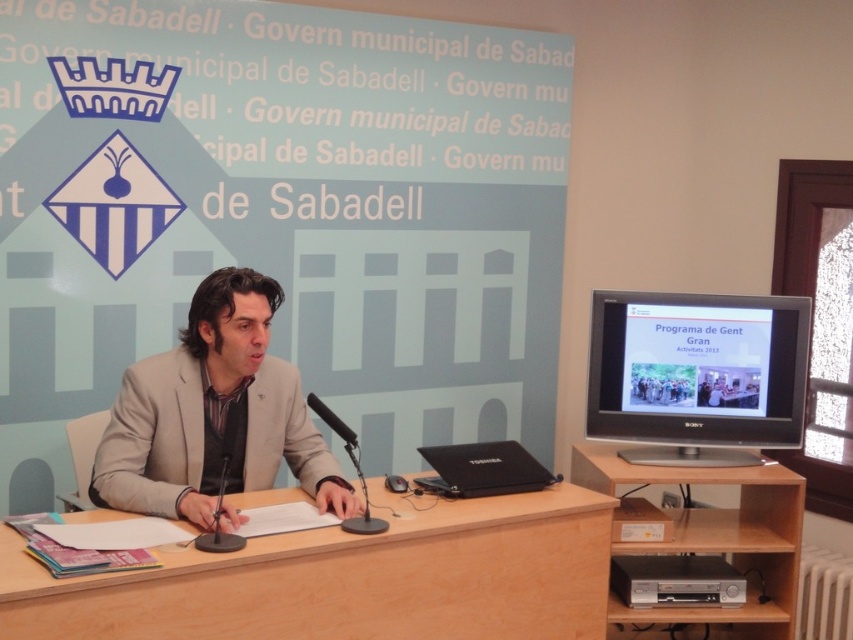
You are standing in the room where the presentation is taking place. You see two points on the screen displaying the slide titled Programa de. The first point is at coordinates point (294, 570) and the second is at point (366, 518). From your perspective, which point is closer to you?

Point (294, 570) is in front of point (366, 518), so it is closer to you.

You are attending a presentation at the Govern municipal de Sabadell. You notice two points marked on the screen. The first point is at coordinates point [482,490] and the second is at point [352,524]. From your perspective, which point is positioned further back in the scene?

Point [482,490] is behind point [352,524], so the first point is further back in the scene.

You are setting up a presentation and need to place a document holder between the matte black monitor at right and the matte black laptop at center. Since the document holder requires a surface that is taller than the laptop but shorter than the monitor, will it fit between them?

The matte black monitor at right has a greater height compared to the matte black laptop at center, so the document holder requiring a surface taller than the laptop but shorter than the monitor can be placed between them as the height difference allows for such placement.